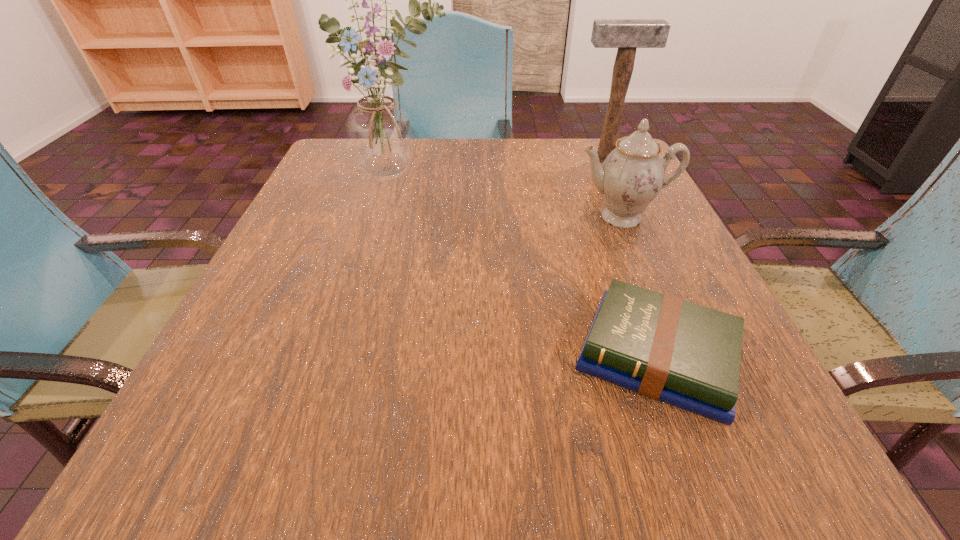
You are a GUI agent. You are given a task and a screenshot of the screen. Output one action in this format:
    pyautogui.click(x=<x>, y=<y>)
    Task: Click on the object at the near right corner
    The height and width of the screenshot is (540, 960).
    Given the screenshot: What is the action you would take?
    pyautogui.click(x=687, y=355)

Find the location of a particular element. The image size is (960, 540). vacant region at the far edge of the desktop is located at coordinates (510, 150).

Locate an element on the screen. The height and width of the screenshot is (540, 960). vacant space at the near edge of the desktop is located at coordinates (521, 451).

In the image, there is a desktop. Where is `vacant space at the left edge`? This screenshot has height=540, width=960. vacant space at the left edge is located at coordinates (361, 242).

Locate an element on the screen. vacant space at the right edge is located at coordinates (645, 230).

Find the location of a particular element. The height and width of the screenshot is (540, 960). blank space at the far left corner of the desktop is located at coordinates (324, 172).

This screenshot has width=960, height=540. In order to click on free space between the nearest object and the mallet in this screenshot , I will do `click(631, 258)`.

Where is `blank region between the mallet and the leftmost object`? The height and width of the screenshot is (540, 960). blank region between the mallet and the leftmost object is located at coordinates (501, 167).

Identify the location of free space between the tallest object and the mallet. This screenshot has width=960, height=540. (501, 167).

Find the location of a particular element. free space that is in between the tallest object and the chinaware is located at coordinates (509, 196).